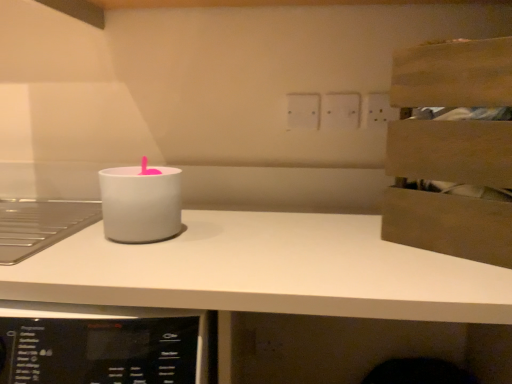
You are a GUI agent. You are given a task and a screenshot of the screen. Output one action in this format:
    pyautogui.click(x=<x>, y=<y>)
    Task: Click on the space that is in front of white matte candle holder at center
    
    Given the screenshot: What is the action you would take?
    pyautogui.click(x=111, y=258)